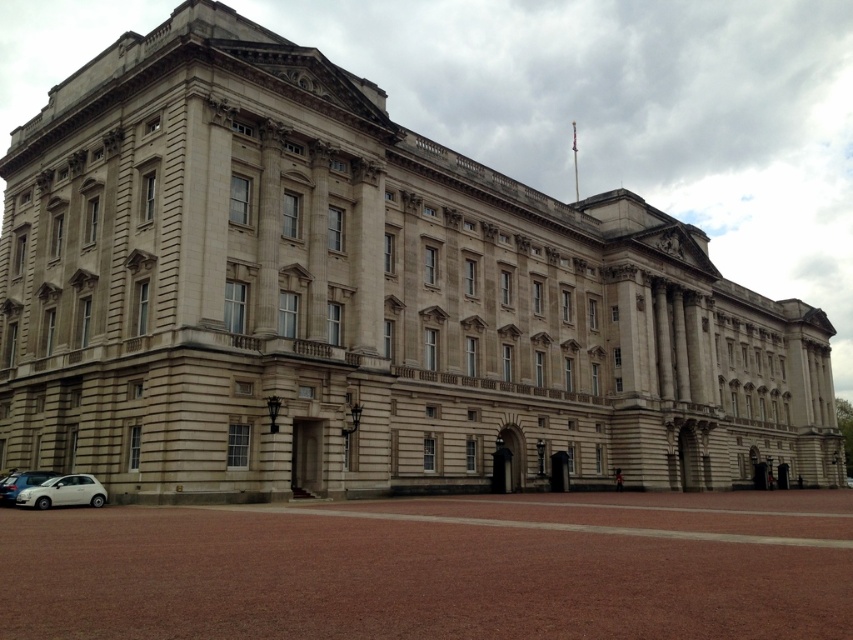
Question: From the image, what is the correct spatial relationship of white matte car at lower left in relation to silver metallic car at lower left?

Choices:
 (A) below
 (B) above

Answer: (B)

Question: Which of the following is the farthest from the observer?

Choices:
 (A) (9, 484)
 (B) (62, 476)

Answer: (A)

Question: Is white matte car at lower left above silver metallic car at lower left?

Choices:
 (A) yes
 (B) no

Answer: (A)

Question: Does white matte car at lower left appear under silver metallic car at lower left?

Choices:
 (A) yes
 (B) no

Answer: (B)